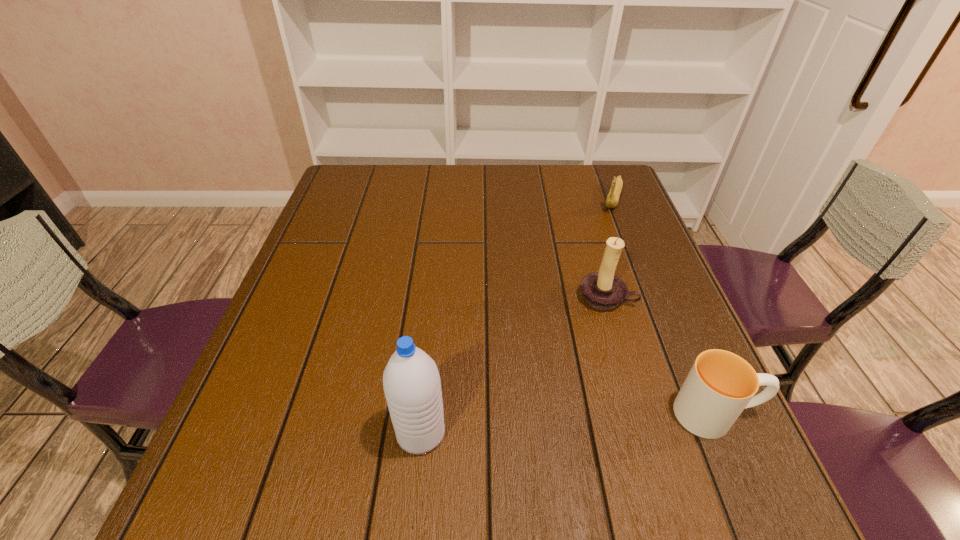
Locate an element on the screen. This screenshot has height=540, width=960. water bottle is located at coordinates (411, 382).

Where is `the tallest object`? This screenshot has width=960, height=540. the tallest object is located at coordinates (411, 382).

Image resolution: width=960 pixels, height=540 pixels. I want to click on cup, so click(720, 385).

The width and height of the screenshot is (960, 540). I want to click on banana, so click(x=612, y=199).

Where is `candle holder`? This screenshot has height=540, width=960. candle holder is located at coordinates (603, 290).

The width and height of the screenshot is (960, 540). I want to click on the third nearest object, so click(603, 290).

Image resolution: width=960 pixels, height=540 pixels. In order to click on free point located on the back of the water bottle in this screenshot , I will do `click(438, 266)`.

Identify the location of vacant space located 0.390m at the stem of the farthest object. (583, 306).

The width and height of the screenshot is (960, 540). Find the location of `vacant area situated at the stem of the farthest object`. vacant area situated at the stem of the farthest object is located at coordinates (597, 263).

Find the location of a particular element. The image size is (960, 540). vacant space located at the stem of the farthest object is located at coordinates (591, 281).